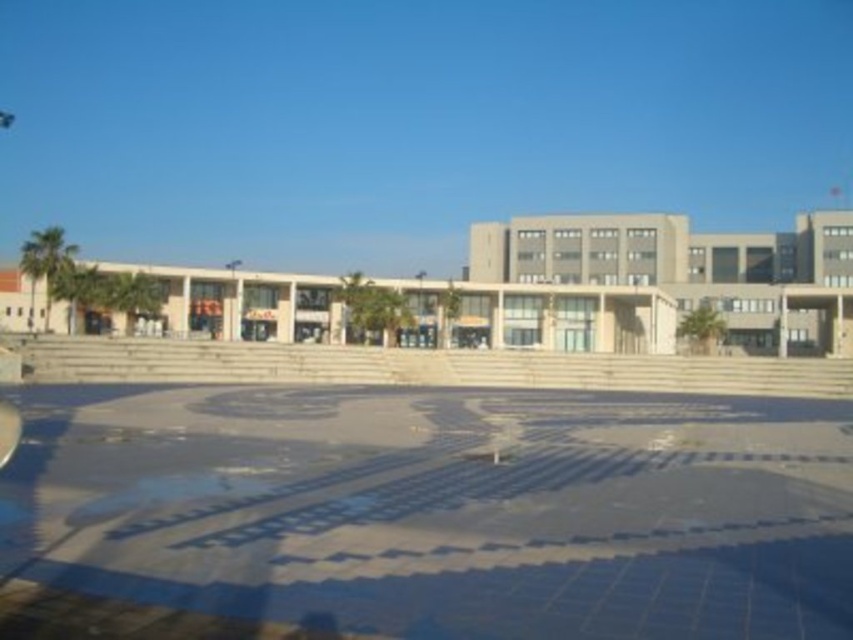
You are standing at the base of the steps leading to the building in the plaza. You notice two points marked on the ground ahead of you. The first point is at coordinates point (535,532) and the second is at point (793,310). If you were to walk directly towards the building, which point would you encounter first?

Point (535,532) is in front of point (793,310), so you would encounter point (535,532) first as you walk towards the building.

You are a maintenance worker inspecting the plaza. You notice the blue mosaic tiles at center and the beige concrete plaza at center. Which surface is located below the other?

The blue mosaic tiles at center is positioned under the beige concrete plaza at center, so the blue mosaic tiles are below the beige concrete plaza.